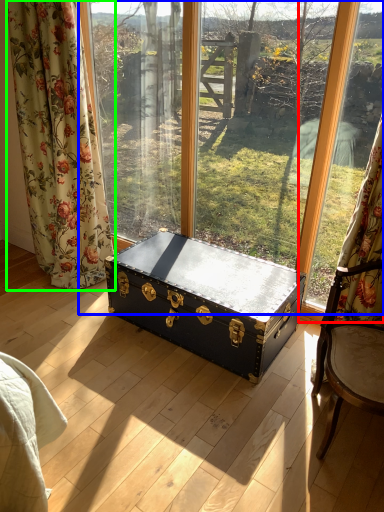
Question: Based on their relative distances, which object is farther from window frame (highlighted by a red box)? Choose from window (highlighted by a blue box) and curtain (highlighted by a green box).

Choices:
 (A) window
 (B) curtain

Answer: (B)